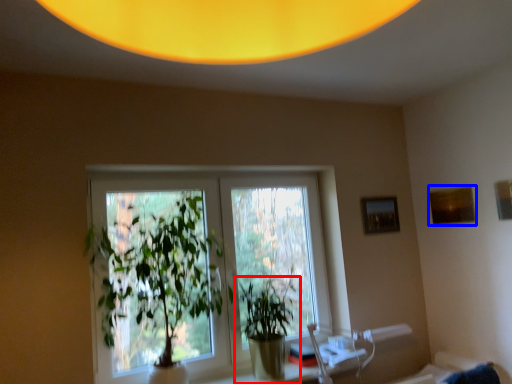
Question: Which object appears closest to the camera in this image, houseplant (highlighted by a red box) or picture frame (highlighted by a blue box)?

Choices:
 (A) houseplant
 (B) picture frame

Answer: (A)